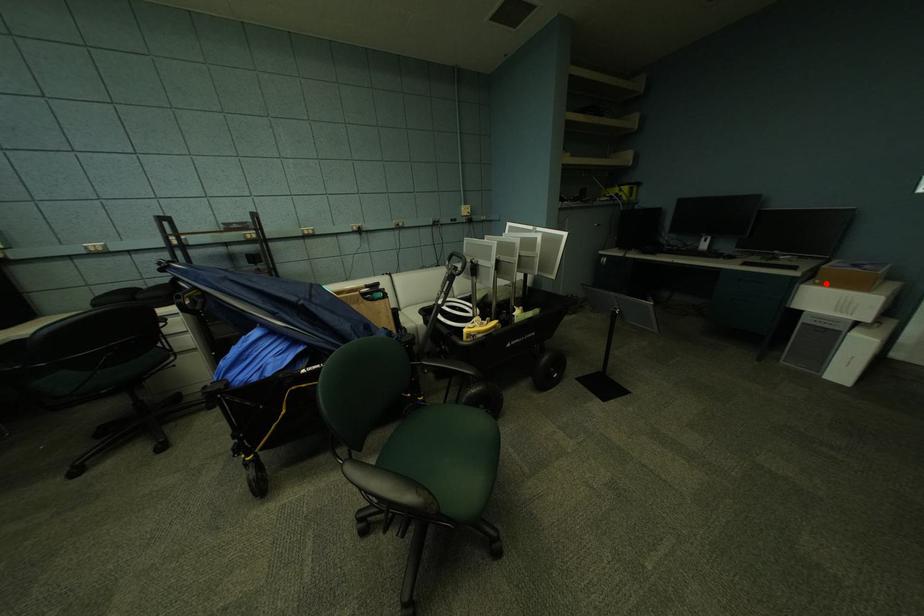
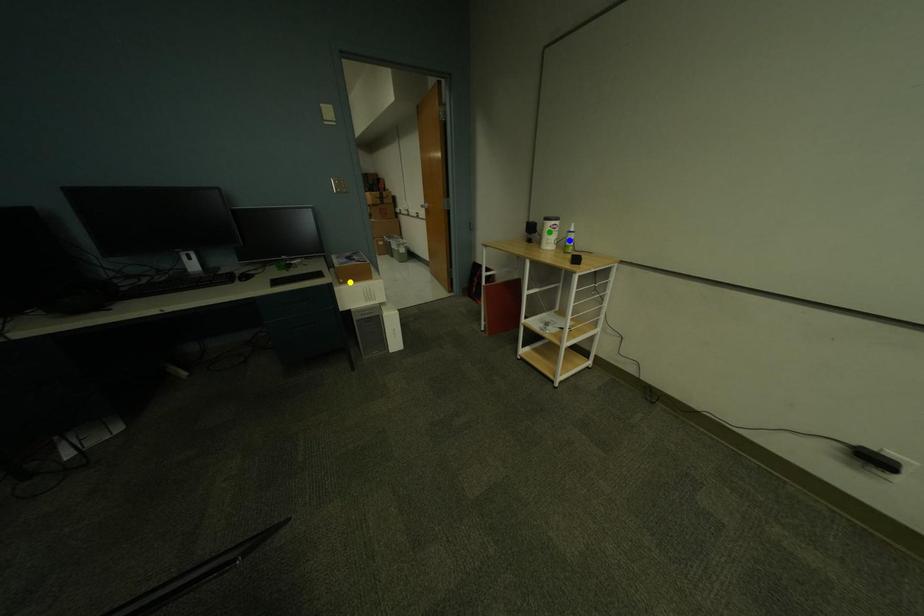
Question: I am providing you with two images of the same scene from different viewpoints. A red point is marked on the first image. You are given multiple points on the second image. Can you choose the point in image 2 that corresponds to the point in image 1?

Choices:
 (A) blue point
 (B) green point
 (C) yellow point

Answer: (C)